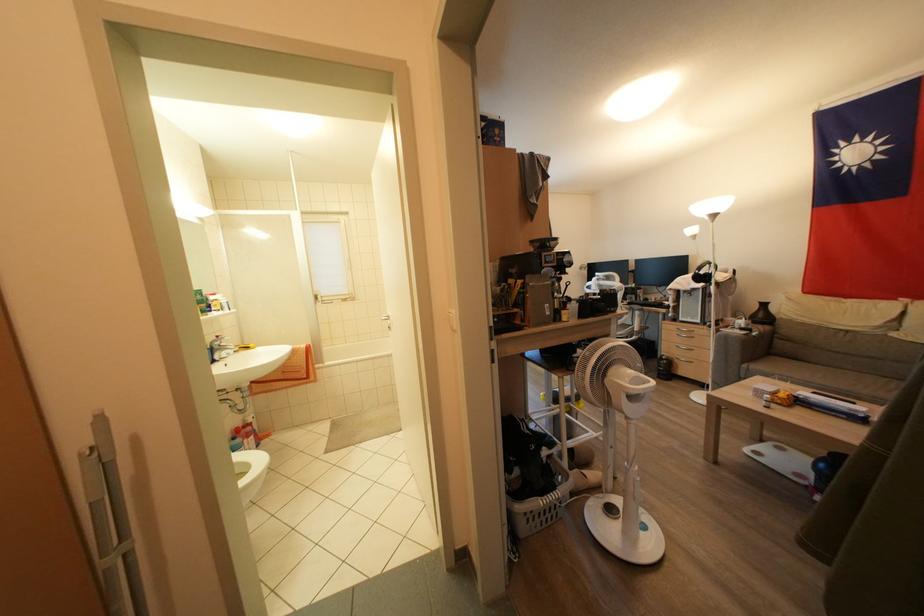
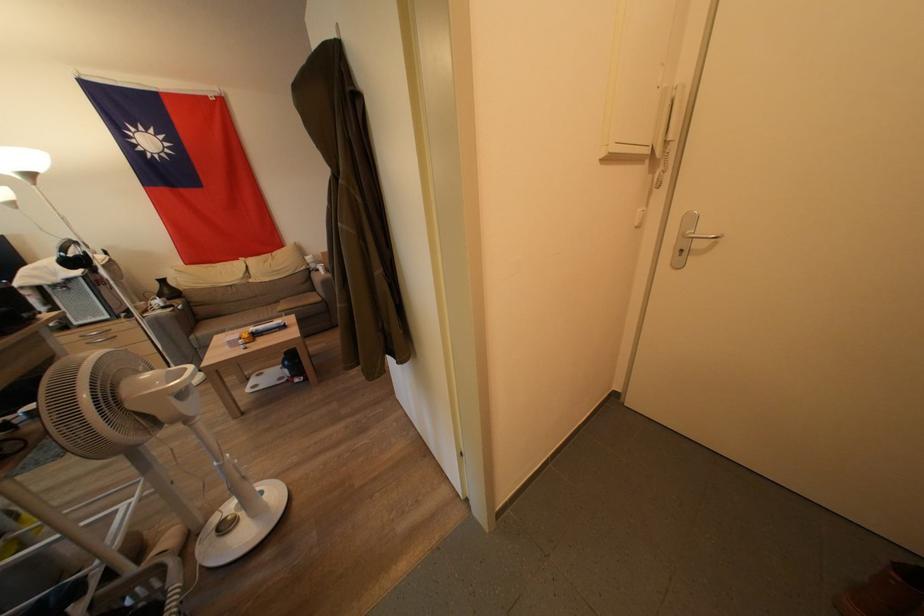
In the second image, find the point that corresponds to [766,320] in the first image.

(172, 296)